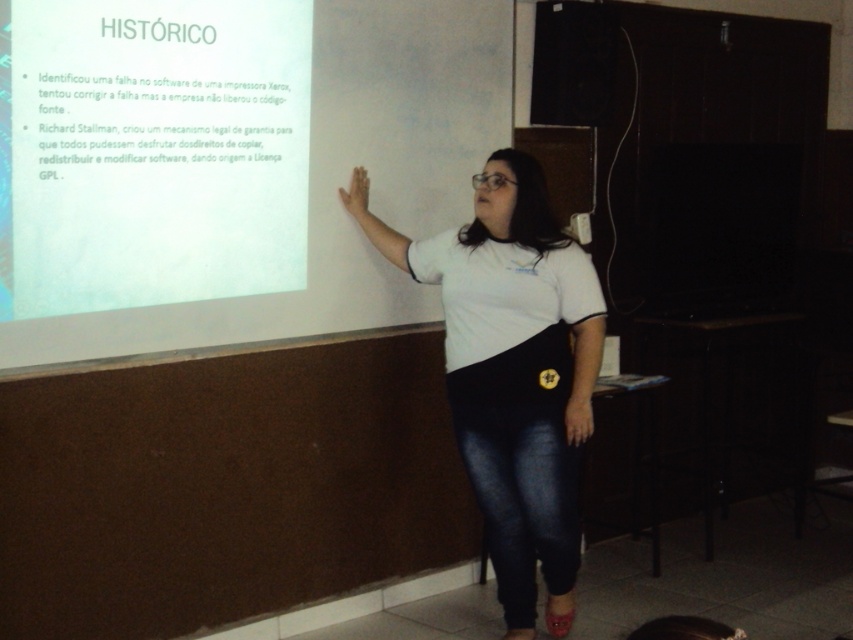
You are a presenter standing at the front of the room. You want to adjust the focus of your projector so that the text on the white matte projection screen at upper left is sharp and clear. The projector has a manual focus ring that you can turn. Considering the screen is 2.72 meters away from you, what distance should you set the projector to focus on?

The white matte projection screen at upper left is 2.72 meters away from the viewer, so you should set the projector to focus at 2.72 meters to ensure the text is sharp and clear.